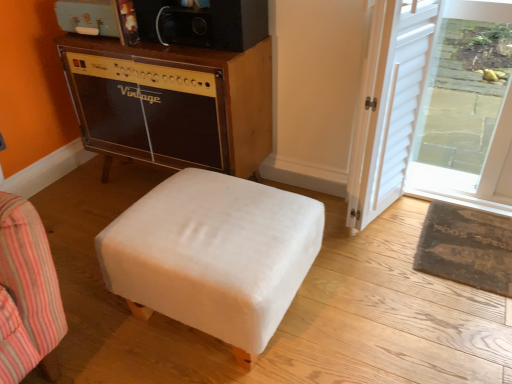
Question: Is point (507, 89) positioned closer to the camera than point (148, 115)?

Choices:
 (A) farther
 (B) closer

Answer: (B)

Question: Looking at their shapes, would you say transparent glass door at upper right is wider or thinner than vintage wood amplifier at upper left?

Choices:
 (A) wide
 (B) thin

Answer: (B)

Question: Which object is positioned closest to the transparent glass door at upper right?

Choices:
 (A) white wood screen door at right
 (B) white velvety ottoman at center
 (C) vintage wood amplifier at upper left
 (D) rustic brown mat at lower right
 (E) rusty metal suitcase at upper left

Answer: (A)

Question: Which object is the closest to the white velvety ottoman at center?

Choices:
 (A) vintage wood amplifier at upper left
 (B) rustic brown mat at lower right
 (C) transparent glass door at upper right
 (D) rusty metal suitcase at upper left
 (E) white wood screen door at right

Answer: (A)